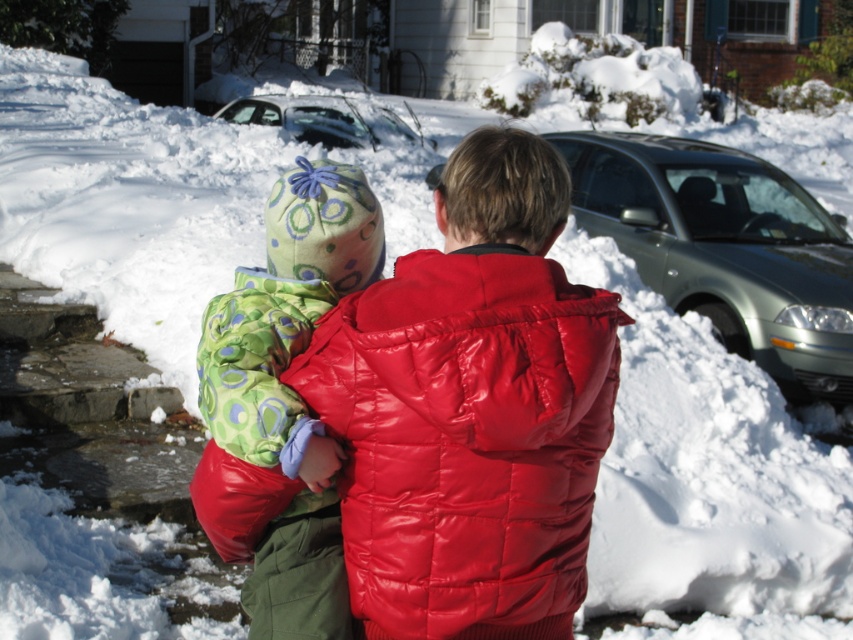
You are standing at the point marked as point [724,248]. What object is located at this point?

The silver metallic sedan at right is located at point [724,248].

You are a delivery driver who needs to park your truck between the silver metallic sedan at right and the silver metallic car at upper center. The truck is 2 meters wide. Can you fit your truck between them?

The silver metallic sedan at right is narrower than the silver metallic car at upper center. However, the exact distance between them isn t provided, so we can t determine if the truck will fit. More information about the spacing between the two cars is needed to answer this question accurately.

Consider the image. You are a delivery robot with a 2 meter tall package on your back. You need to navigate through the path between the silver metallic sedan at right and the silver metallic car at upper center. Can you pass through without tilting your package?

The distance between the silver metallic sedan at right and the silver metallic car at upper center is 6.48 meters. Since your package is only 2 meters tall, the height is not an issue. However, the question about tilting depends on the width of the path, which isn not provided in the objects description. Therefore, we cannot determine if tilting is necessary based on the given information.